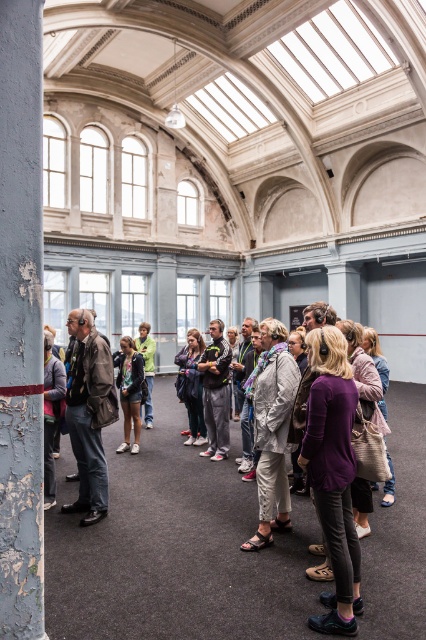
You are a tour guide leading a group in the historic building. You notice two items at the center of the scene. Which item takes up more space, the dark gray sweatpants at center or the green denim jacket at center?

The green denim jacket at center takes up more space than the dark gray sweatpants at center because the dark gray sweatpants at center occupies less space than green denim jacket at center.

You are a tour guide leading a group in the historic building. You notice two jackets left on a bench at the center. Which jacket is positioned to the right of the other? The jackets are the light gray fabric jacket at center and the green denim jacket at center.

The light gray fabric jacket at center is to the right of the green denim jacket at center.